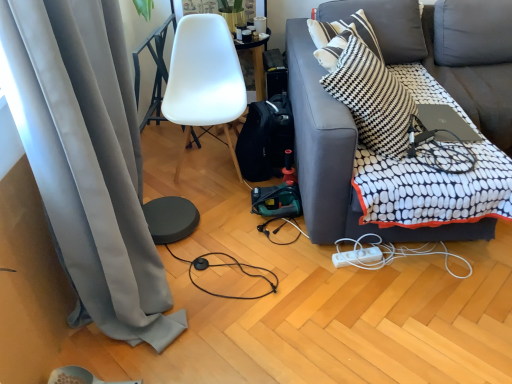
The width and height of the screenshot is (512, 384). Find the location of `free region under black cable at lower center (from a real-world perspective)`. free region under black cable at lower center (from a real-world perspective) is located at coordinates (221, 276).